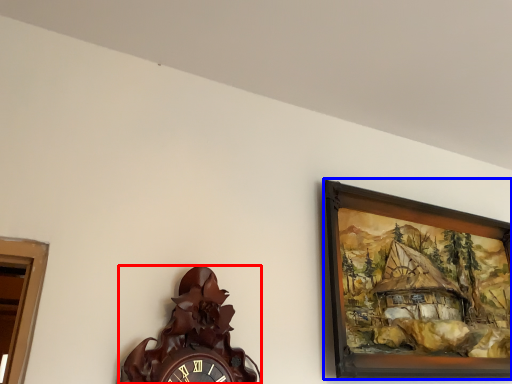
Question: Which of the following is the farthest to the observer, wall clock (highlighted by a red box) or picture frame (highlighted by a blue box)?

Choices:
 (A) wall clock
 (B) picture frame

Answer: (B)